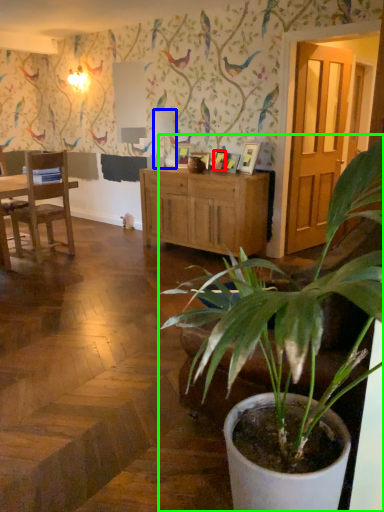
Question: Considering the real-world distances, which object is farthest from picture frame (highlighted by a red box)? lamp (highlighted by a blue box) or houseplant (highlighted by a green box)?

Choices:
 (A) lamp
 (B) houseplant

Answer: (B)